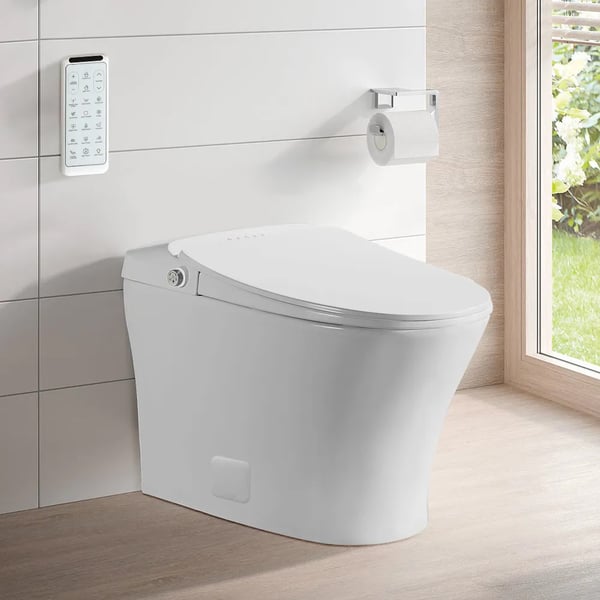
This screenshot has width=600, height=600. I want to click on white tile, so click(x=69, y=262).